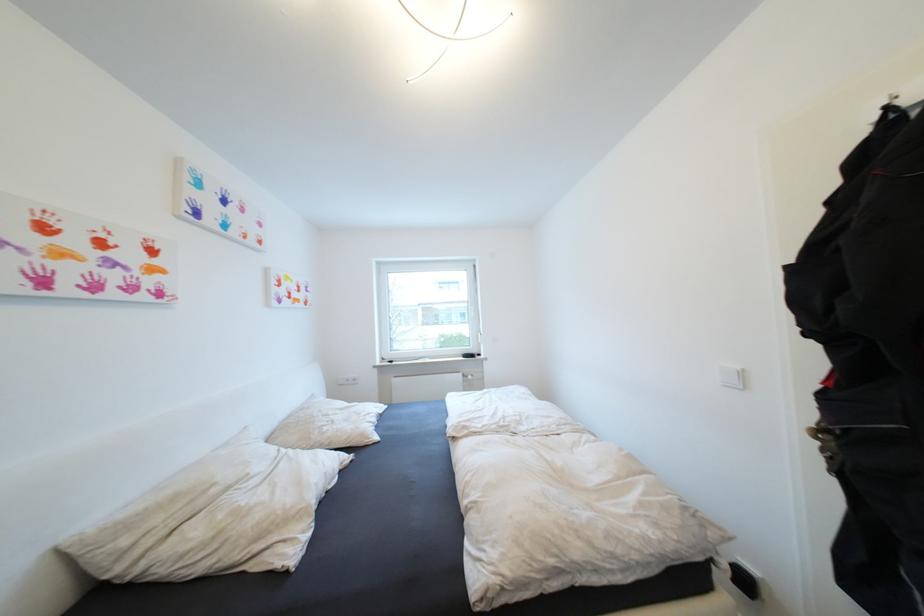
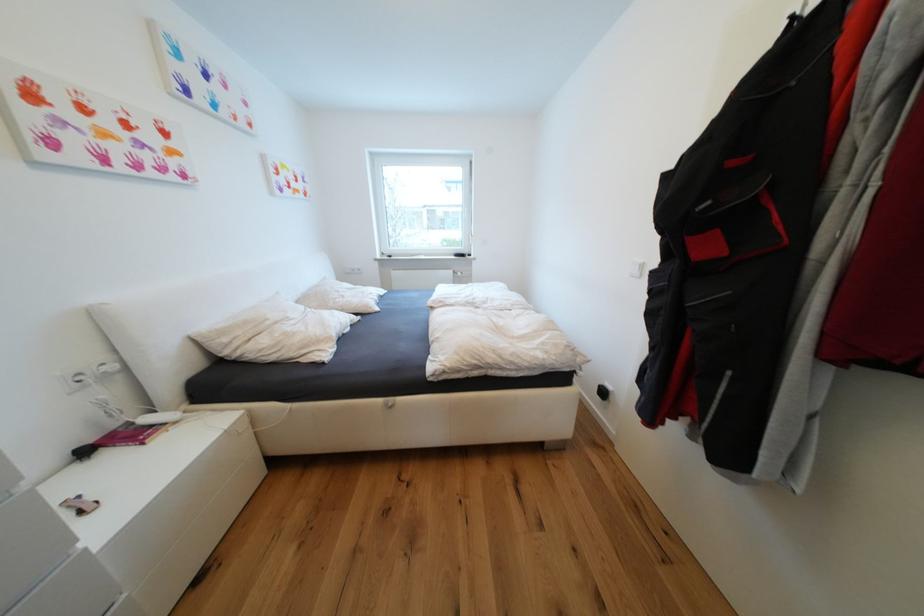
In the second image, find the point that corresponds to the point at 131,543 in the first image.

(233, 341)